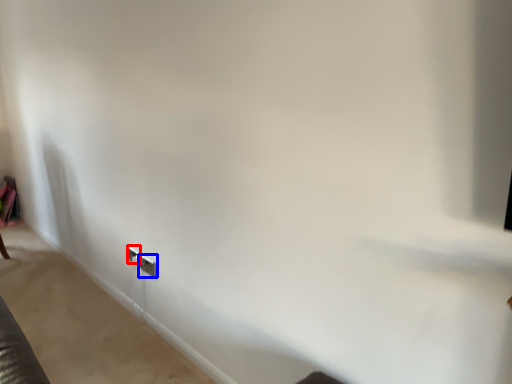
Question: Which object is further to the camera taking this photo, electric outlet (highlighted by a red box) or electric outlet (highlighted by a blue box)?

Choices:
 (A) electric outlet
 (B) electric outlet

Answer: (A)